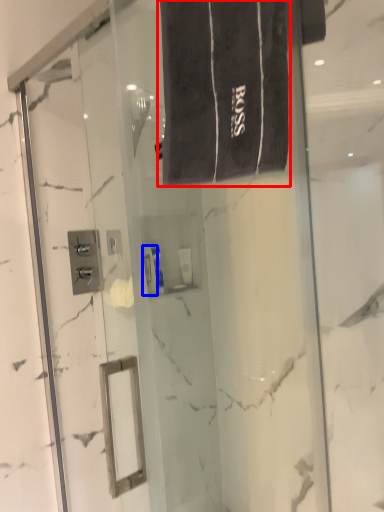
Question: Which of the following is the closest to the observer, bath towel (highlighted by a red box) or toiletry (highlighted by a blue box)?

Choices:
 (A) bath towel
 (B) toiletry

Answer: (A)